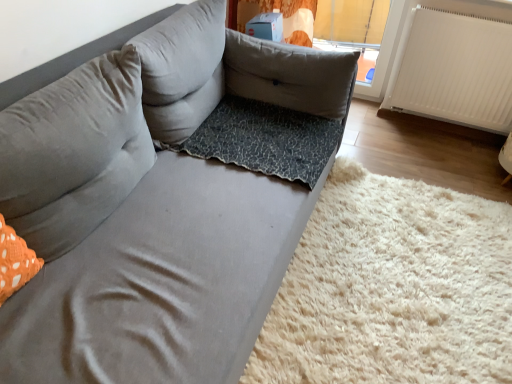
Question: Can you confirm if gray fabric pillow at center, which ranks as the second pillow in left-to-right order, is shorter than leopard print fabric at lower right?

Choices:
 (A) no
 (B) yes

Answer: (A)

Question: Is leopard print fabric at lower right completely or partially inside gray fabric pillow at center, arranged as the second pillow when viewed from the right?

Choices:
 (A) yes
 (B) no

Answer: (B)

Question: Is gray fabric pillow at center, arranged as the second pillow when viewed from the right, far from leopard print fabric at lower right?

Choices:
 (A) no
 (B) yes

Answer: (B)

Question: Does gray fabric pillow at center, arranged as the second pillow when viewed from the right, have a greater width compared to leopard print fabric at lower right?

Choices:
 (A) no
 (B) yes

Answer: (A)

Question: Considering the relative positions of gray fabric pillow at center, which ranks as the second pillow in left-to-right order, and leopard print fabric at lower right in the image provided, is gray fabric pillow at center, which ranks as the second pillow in left-to-right order, to the right of leopard print fabric at lower right from the viewer's perspective?

Choices:
 (A) no
 (B) yes

Answer: (A)

Question: In the image, is gray fabric pillow at center, arranged as the second pillow when viewed from the right, positioned in front of or behind leopard print cushion at center, which appears as the third pillow when viewed from the left?

Choices:
 (A) behind
 (B) front

Answer: (B)

Question: Is point (199, 82) closer or farther from the camera than point (315, 54)?

Choices:
 (A) closer
 (B) farther

Answer: (A)

Question: In the image, is gray fabric pillow at center, arranged as the second pillow when viewed from the right, on the left side or the right side of leopard print cushion at center, placed as the first pillow when sorted from right to left?

Choices:
 (A) right
 (B) left

Answer: (B)

Question: Considering the positions of gray fabric pillow at center, which ranks as the second pillow in left-to-right order, and leopard print cushion at center, placed as the first pillow when sorted from right to left, in the image, is gray fabric pillow at center, which ranks as the second pillow in left-to-right order, taller or shorter than leopard print cushion at center, placed as the first pillow when sorted from right to left,?

Choices:
 (A) short
 (B) tall

Answer: (B)

Question: From their relative heights in the image, would you say leopard print fabric dog bed at center is taller or shorter than leopard print fabric at lower right?

Choices:
 (A) short
 (B) tall

Answer: (A)

Question: In terms of width, does leopard print fabric dog bed at center look wider or thinner when compared to leopard print fabric at lower right?

Choices:
 (A) thin
 (B) wide

Answer: (A)

Question: In terms of size, does leopard print fabric dog bed at center appear bigger or smaller than leopard print fabric at lower right?

Choices:
 (A) small
 (B) big

Answer: (A)

Question: In the image, is leopard print fabric dog bed at center positioned in front of or behind leopard print fabric at lower right?

Choices:
 (A) behind
 (B) front

Answer: (A)

Question: Based on their positions, is leopard print cushion at center, which appears as the third pillow when viewed from the left, located to the left or right of gray fabric pillow at upper left, which is counted as the 1th pillow, starting from the left?

Choices:
 (A) left
 (B) right

Answer: (B)

Question: Considering the positions of leopard print cushion at center, which appears as the third pillow when viewed from the left, and gray fabric pillow at upper left, which is counted as the 1th pillow, starting from the left, in the image, is leopard print cushion at center, which appears as the third pillow when viewed from the left, bigger or smaller than gray fabric pillow at upper left, which is counted as the 1th pillow, starting from the left,?

Choices:
 (A) small
 (B) big

Answer: (A)